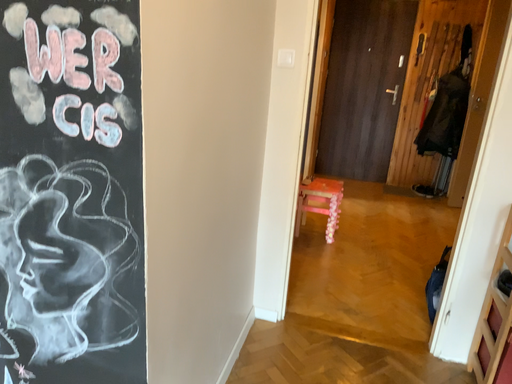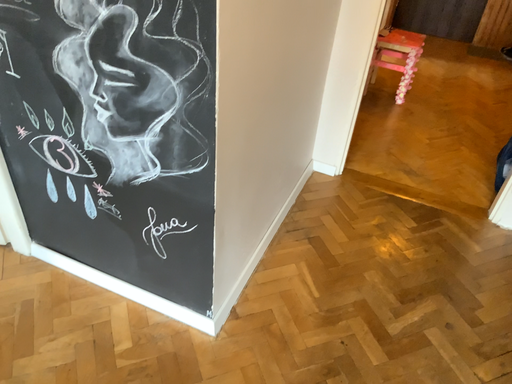
Question: How did the camera likely rotate when shooting the video?

Choices:
 (A) rotated left
 (B) rotated right

Answer: (A)